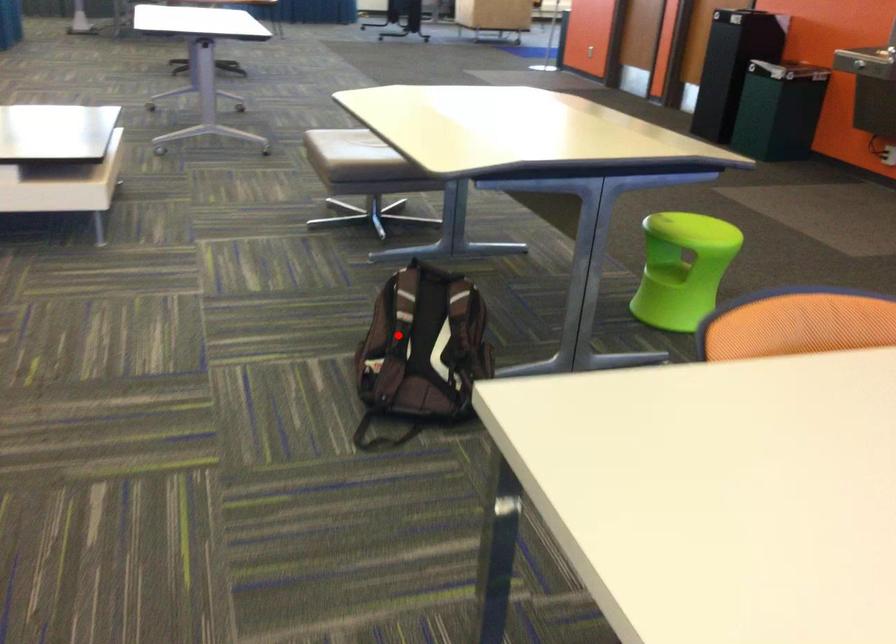
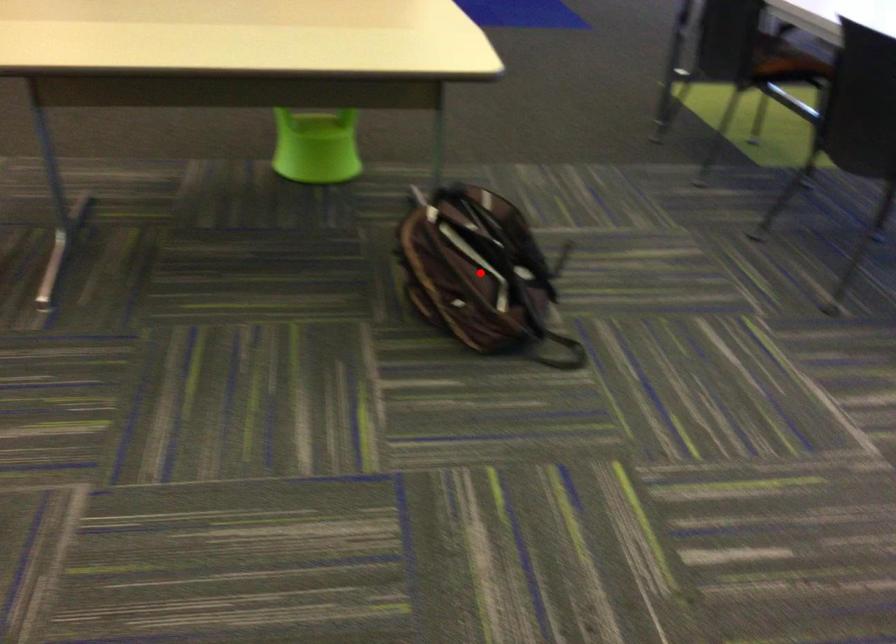
I am providing you with two images of the same scene from different viewpoints. A red point is marked on the first image and another point is marked on the second image. Is the red point in image1 aligned with the point shown in image2?

Yes